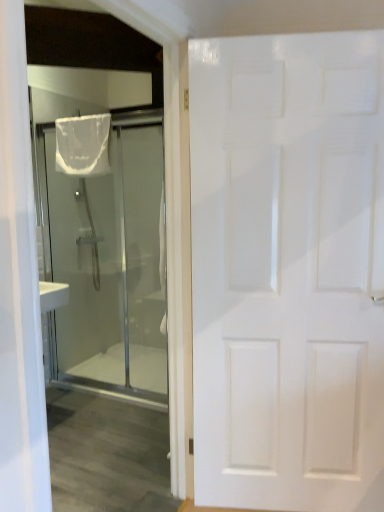
Question: Relative to transparent glass shower at left, which ranks as the first door in left-to-right order, is white sheer fabric at upper left in front or behind?

Choices:
 (A) front
 (B) behind

Answer: (B)

Question: Considering the positions of white sheer fabric at upper left and transparent glass shower at left, the 2th door in the right-to-left sequence, in the image, is white sheer fabric at upper left bigger or smaller than transparent glass shower at left, the 2th door in the right-to-left sequence,?

Choices:
 (A) big
 (B) small

Answer: (B)

Question: Which is nearer to the white matte door at right, which is counted as the second door, starting from the back?

Choices:
 (A) white sheer fabric at upper left
 (B) transparent glass shower at left, the second door viewed from the front

Answer: (A)

Question: Which object is the farthest from the white sheer fabric at upper left?

Choices:
 (A) white matte door at right, the second door in the left-to-right sequence
 (B) transparent glass shower at left, the 1th door in the back-to-front sequence

Answer: (A)